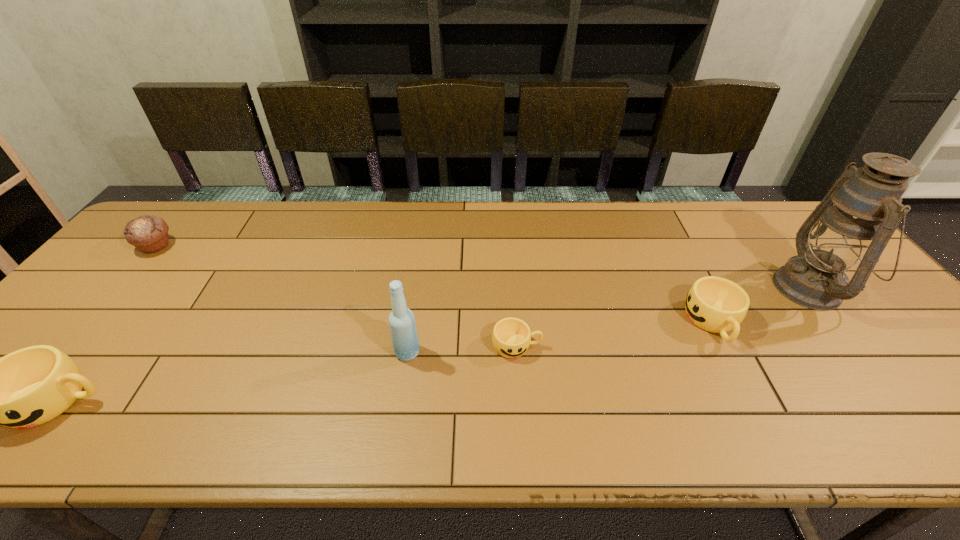
Identify the location of the second cup from left to right. (511, 337).

Image resolution: width=960 pixels, height=540 pixels. What are the coordinates of `the fourth object from left to right` in the screenshot? It's located at (511, 337).

The width and height of the screenshot is (960, 540). I want to click on the rightmost cup, so click(x=715, y=304).

Where is `the second tallest cup`? The width and height of the screenshot is (960, 540). the second tallest cup is located at coordinates (715, 304).

At what (x,y) coordinates should I click in order to perform the action: click on oil lamp. Please return your answer as a coordinate pair (x, y). Looking at the image, I should click on (858, 216).

This screenshot has height=540, width=960. What are the coordinates of `the rightmost object` in the screenshot? It's located at (858, 216).

You are a GUI agent. You are given a task and a screenshot of the screen. Output one action in this format:
    pyautogui.click(x=<x>, y=<y>)
    Task: Click on the muffin
    The height and width of the screenshot is (540, 960).
    Given the screenshot: What is the action you would take?
    pyautogui.click(x=148, y=233)

Identify the location of the fourth object from right to left. Image resolution: width=960 pixels, height=540 pixels. (404, 336).

Identify the location of the fifth shortest object. The height and width of the screenshot is (540, 960). (404, 336).

The image size is (960, 540). Find the location of `free space located 0.340m on the left of the second cup from right to left`. free space located 0.340m on the left of the second cup from right to left is located at coordinates (350, 346).